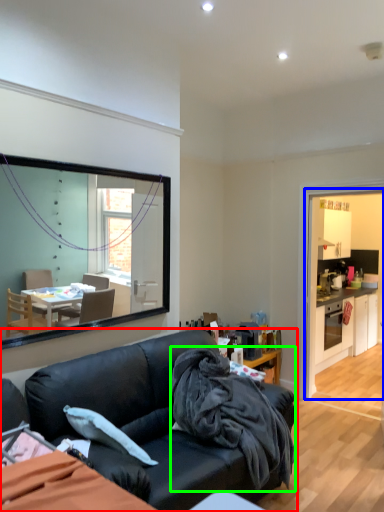
Question: Which object is the farthest from studio couch (highlighted by a red box)? Choose among these: dresser (highlighted by a blue box) or blanket (highlighted by a green box).

Choices:
 (A) dresser
 (B) blanket

Answer: (A)